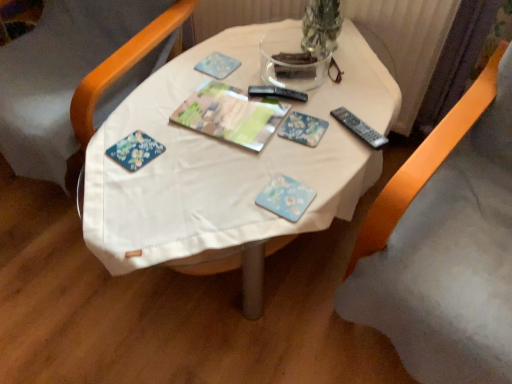
Identify the location of free space in front of floral-patterned paper at center, the second paperback book when ordered from front to back. (297, 172).